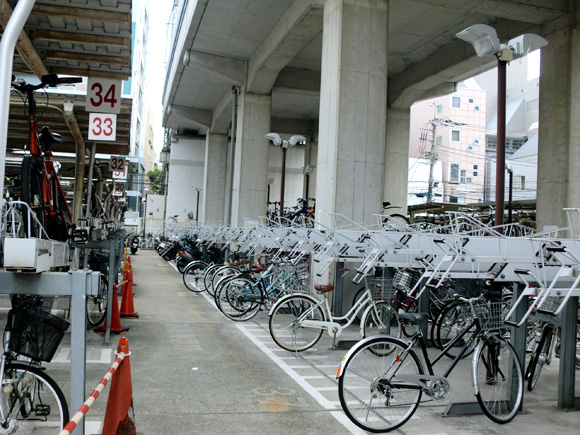
Find the location of `frame`. frame is located at coordinates (561, 398).